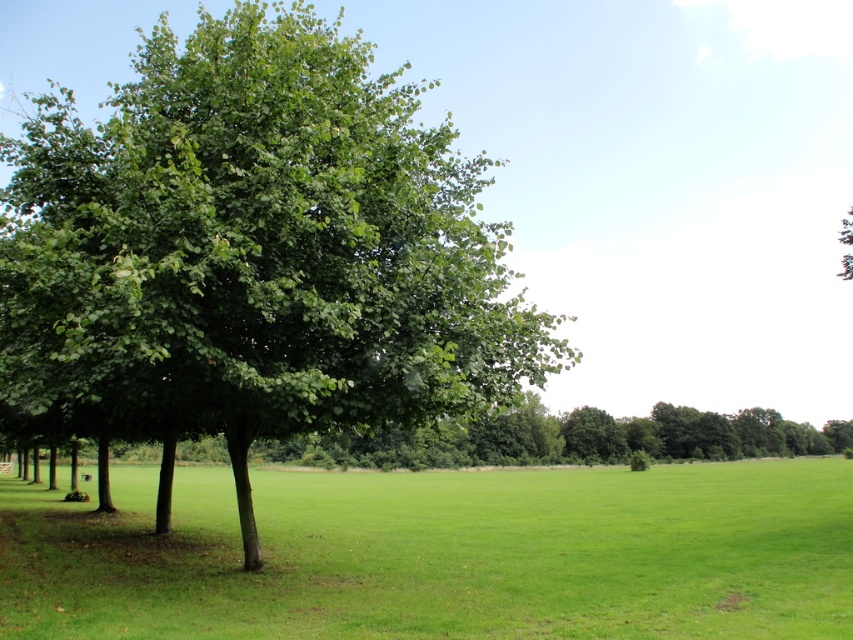
You are standing on the path between the green leafy tree at left and the green leafy tree at center. Which direction should you walk to reach the tree that is further away from the center of the image?

The green leafy tree at left is to the left of the green leafy tree at center, so the tree further away from the center would be the green leafy tree at left. Walk towards the left to reach it.

You are a landscape architect designing a walking path between the green grassy field at center and the green leafy tree at center. The path must be exactly 100 feet long. Based on the scene description, will the path be long enough to connect them?

The distance between the green grassy field at center and the green leafy tree at center is 101.72 feet. Since the path is only 100 feet long, it will not be long enough to connect them.

You are standing in the middle of the green grassy field at center and want to walk towards the trees. Which direction should you head to reach the green leafy tree at left?

Since the green leafy tree at left is positioned on the left side of the green grassy field at center, you should head towards the left to reach the green leafy tree at left.